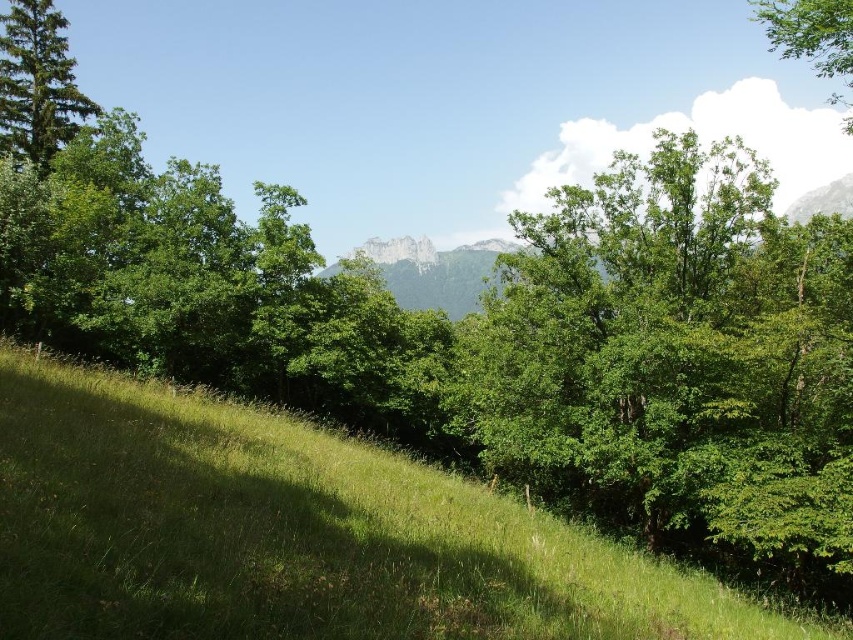
Question: Considering the relative positions of green grassy hillside at lower left and green leafy tree at upper right in the image provided, where is green grassy hillside at lower left located with respect to green leafy tree at upper right?

Choices:
 (A) below
 (B) above

Answer: (A)

Question: Is green grassy hillside at lower left positioned in front of green leafy tree at upper right?

Choices:
 (A) yes
 (B) no

Answer: (A)

Question: Estimate the real-world distances between objects in this image. Which object is closer to the green leafy tree at upper right?

Choices:
 (A) green grassy hillside at lower left
 (B) green leafy tree at center
 (C) green matte tree at upper left

Answer: (B)

Question: Which point is closer to the camera taking this photo?

Choices:
 (A) (802, 296)
 (B) (180, 616)
 (C) (24, 4)
 (D) (788, 10)

Answer: (B)

Question: Which object is farther from the camera taking this photo?

Choices:
 (A) green leafy tree at upper right
 (B) green grassy hillside at lower left

Answer: (A)

Question: Can you confirm if green grassy hillside at lower left is smaller than green leafy tree at upper right?

Choices:
 (A) yes
 (B) no

Answer: (A)